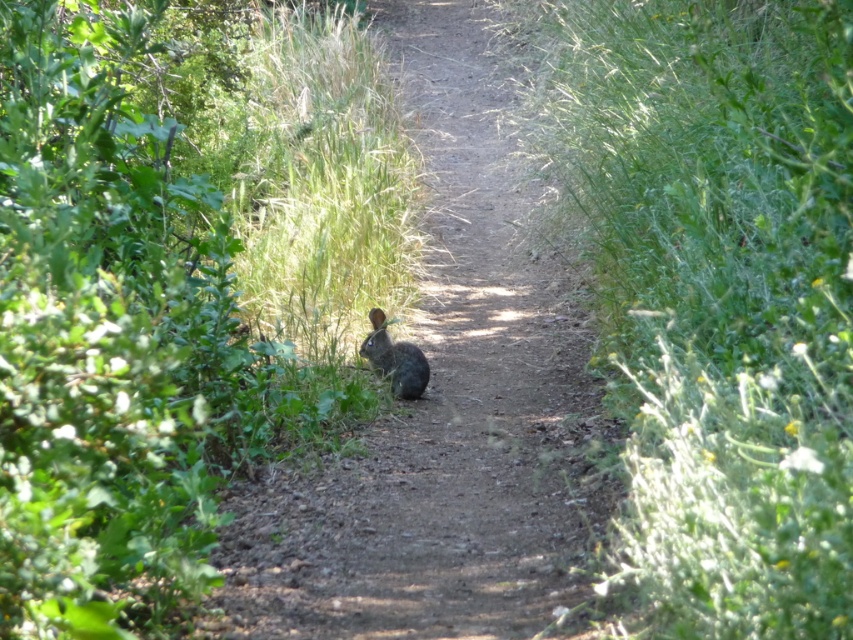
You are a hiker walking along the dirt path and notice the green leafy bush at center and the fuzzy brown rabbit at center. Which object is wider?

The fuzzy brown rabbit at center is wider than the green leafy bush at center.

You are a hiker walking along the dirt path and notice both the green leafy bush at center and the brown fur rabbit at center. Which object is closer to your left side as you face the path ahead?

The green leafy bush at center is to the left of the brown fur rabbit at center, so it is closer to your left side as you face the path ahead.

You are a hiker walking along the dirt path and notice the green leafy bush at center and the fuzzy brown rabbit at center. Which object is taller?

The fuzzy brown rabbit at center is taller than the green leafy bush at center.